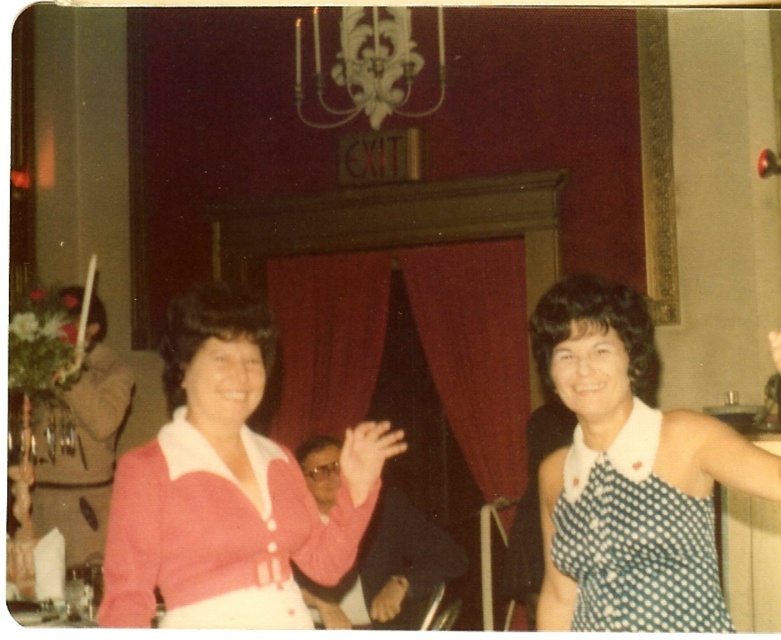
Is point (376, 448) more distant than point (391, 589)?

No, (376, 448) is closer to viewer.

Consider the image. Who is more distant from viewer, [380,436] or [398,579]?

Point [380,436]

The image size is (781, 640). In order to click on matte pink sweater at center in this screenshot , I will do `click(366, 456)`.

Does pink matte cardigan at center lie behind matte pink sweater at center?

No, pink matte cardigan at center is closer to the viewer.

Is pink matte cardigan at center bigger than matte pink sweater at center?

Indeed, pink matte cardigan at center has a larger size compared to matte pink sweater at center.

Is point (287, 460) less distant than point (368, 472)?

That is False.

Where is `pink matte cardigan at center`? This screenshot has width=781, height=640. pink matte cardigan at center is located at coordinates (x=218, y=490).

Which is in front, point (166, 442) or point (373, 595)?

Point (166, 442)

Measure the distance between pink matte cardigan at center and camera.

A distance of 2.45 meters exists between pink matte cardigan at center and camera.

The image size is (781, 640). I want to click on pink matte cardigan at center, so click(218, 490).